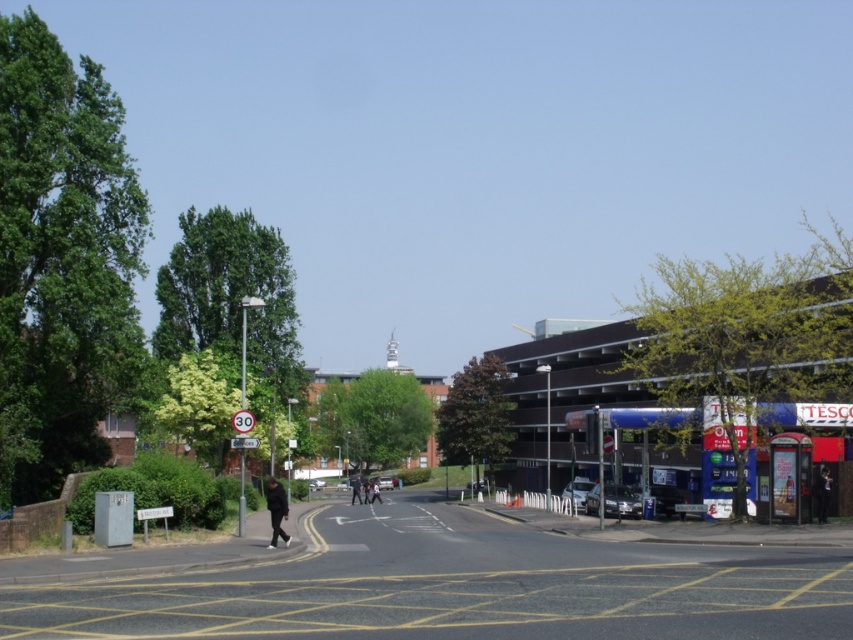
You are a pedestrian standing on the sidewalk and see the white plastic sign at left and the black matte person at center. Which object is higher in the image?

The white plastic sign at left is located above the black matte person at center, so it is higher in the image.

You are a delivery person standing at the point marked by the coordinates point (276,509). You need to deliver a package to the address located near the roundabout with the speed limit sign. Which direction should you head towards from your current position?

The point (276,509) is on dark blue jacket at lower left, so you should head towards the roundabout with the speed limit sign which is at the center of the image. Based on the scene description, the roundabout is in the center, so you should move towards the center from the lower left position.

You are standing at the center of the roundabout and want to locate the dark blue jacket at lower left. Which direction should you face to see it?

To locate the dark blue jacket at lower left, you should face the left side of the scene since it is positioned at point (276,509) relative to the center.